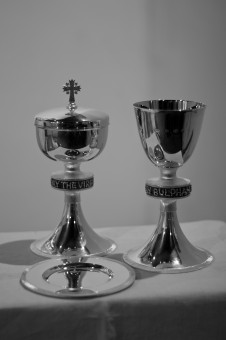
I want to click on table, so click(159, 312).